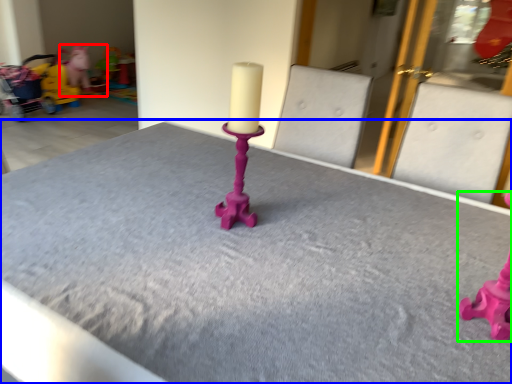
Question: Based on their relative distances, which object is nearer to toy (highlighted by a red box)? Choose from table (highlighted by a blue box) and toy (highlighted by a green box).

Choices:
 (A) table
 (B) toy

Answer: (A)